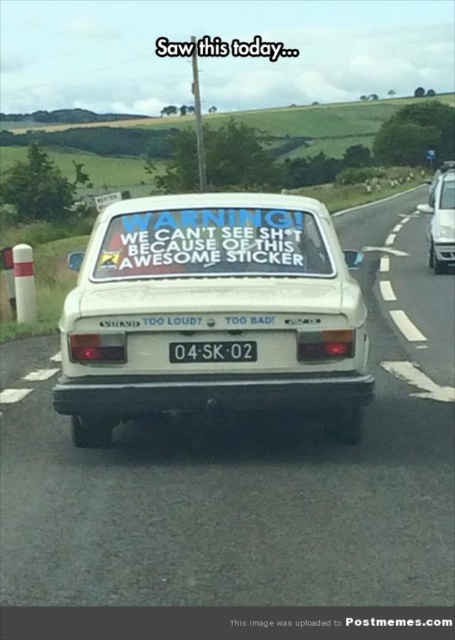
Between white matte car at right and black plastic license plate at center, which one has more height?

Standing taller between the two is white matte car at right.

Can you confirm if white matte car at right is positioned above black plastic license plate at center?

Indeed, white matte car at right is positioned over black plastic license plate at center.

Which is in front, point (449, 225) or point (208, 342)?

Positioned in front is point (208, 342).

You are a GUI agent. You are given a task and a screenshot of the screen. Output one action in this format:
    pyautogui.click(x=<x>, y=<y>)
    Task: Click on the white matte car at right
    Image resolution: width=455 pixels, height=640 pixels.
    Given the screenshot: What is the action you would take?
    pyautogui.click(x=440, y=218)

Can you confirm if white matte sticker at center is taller than white matte car at right?

No.

Where is `white matte sticker at center`? The height and width of the screenshot is (640, 455). white matte sticker at center is located at coordinates (212, 312).

Is point (278, 572) more distant than point (186, 362)?

No, it is not.

The width and height of the screenshot is (455, 640). Identify the location of white plastic car at center. (232, 492).